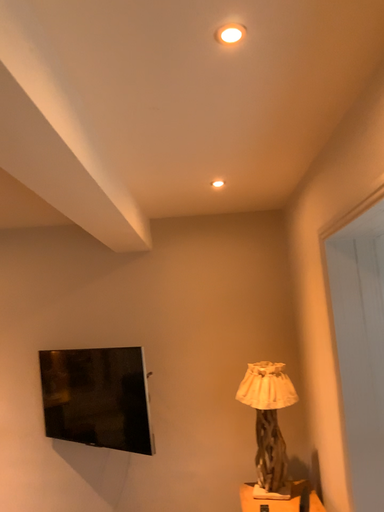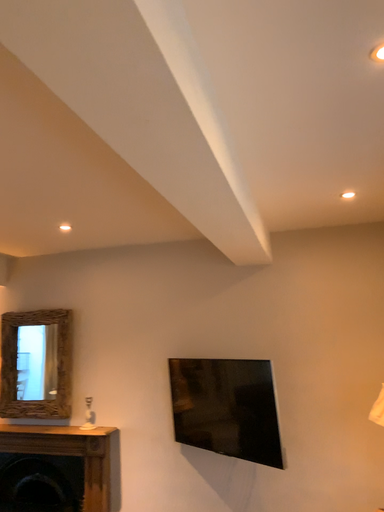
Question: Which way did the camera rotate in the video?

Choices:
 (A) rotated left
 (B) rotated right

Answer: (A)